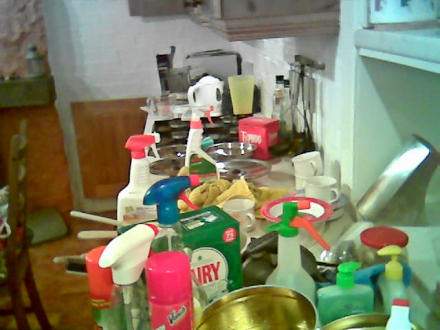
This screenshot has width=440, height=330. Find the location of `floor`. floor is located at coordinates (63, 292).